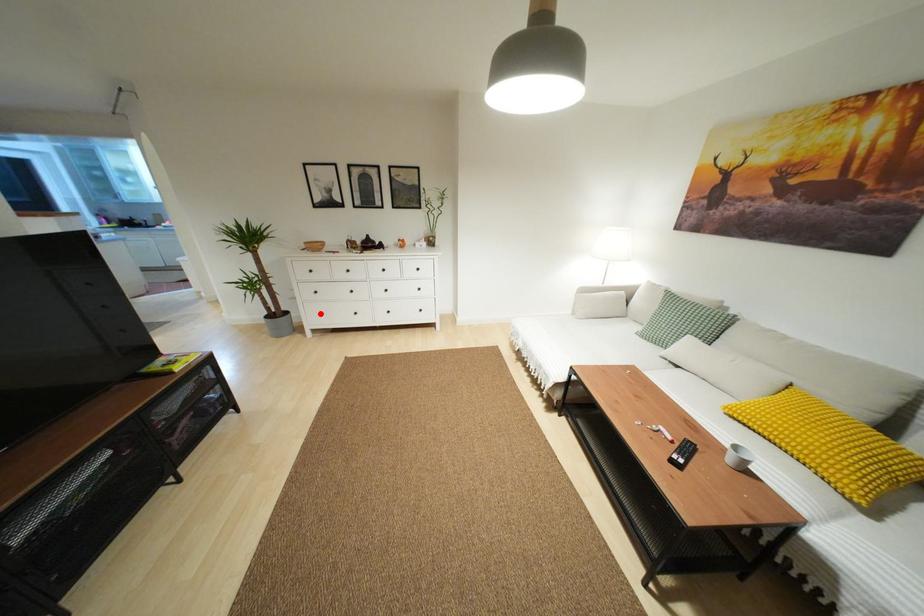
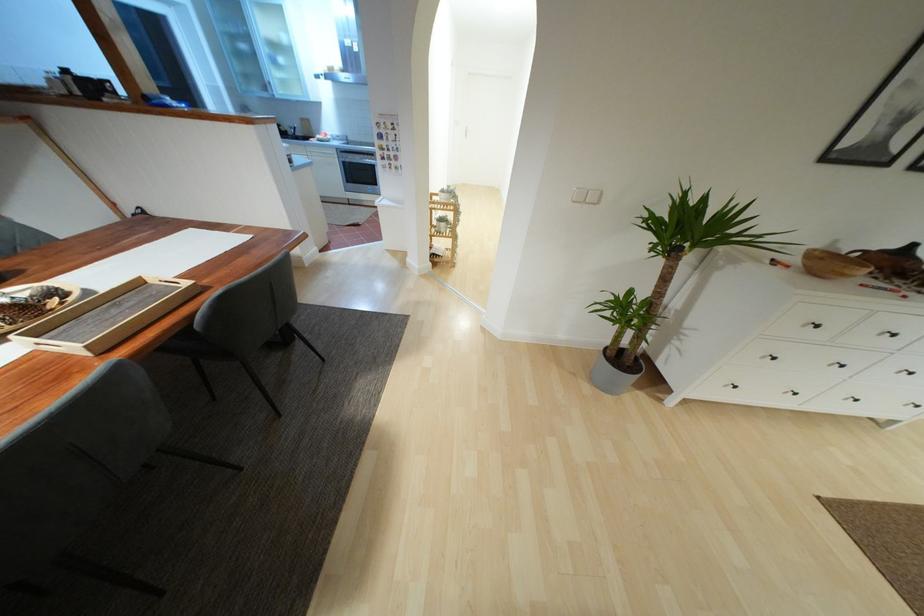
Locate, in the second image, the point that corresponds to the highlighted location in the first image.

(735, 387)